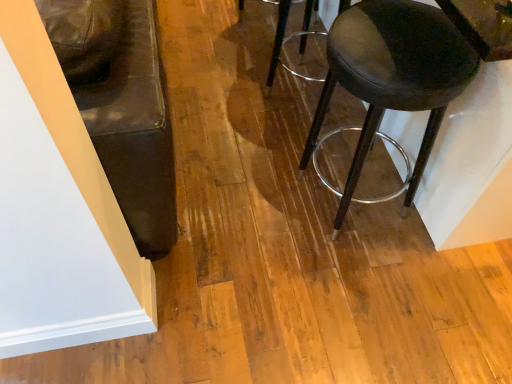
What are the coordinates of `vacant space underneath transparent plastic stool at center, which ranks as the 2th stool in bottom-to-top order (from a real-world perspective)` in the screenshot? It's located at (283, 107).